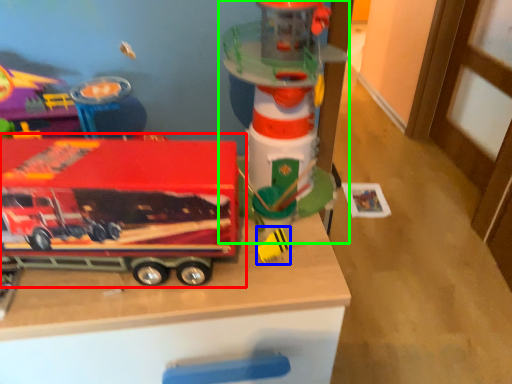
Question: Considering the real-world distances, which object is farthest from toy (highlighted by a red box)? toy (highlighted by a blue box) or toy (highlighted by a green box)?

Choices:
 (A) toy
 (B) toy

Answer: (A)